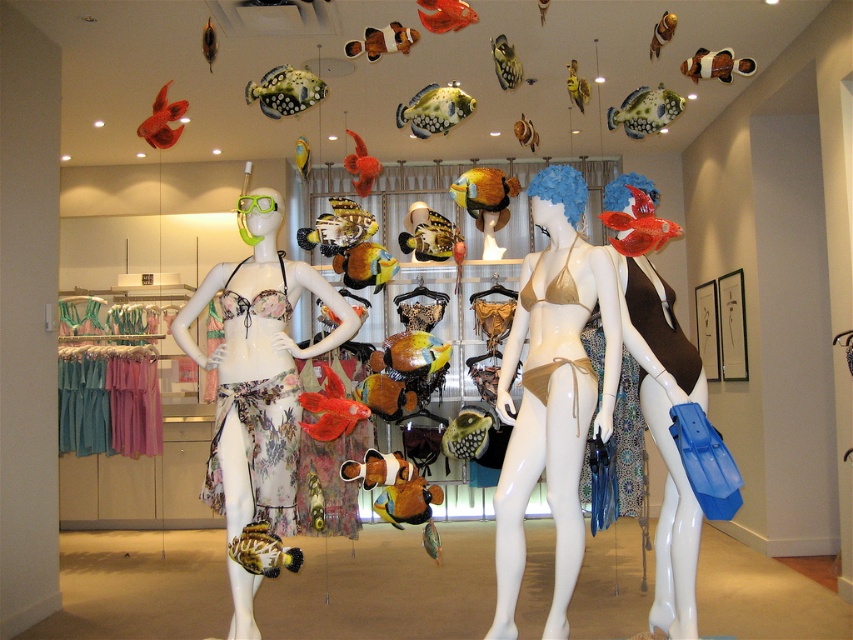
Is point (630, 205) positioned after point (405, 298)?

No.

I want to click on matte brown swimsuit at center, so click(659, 388).

Image resolution: width=853 pixels, height=640 pixels. What are the coordinates of `matte brown swimsuit at center` in the screenshot? It's located at (659, 388).

Does point (602, 266) lie behind point (422, 289)?

No, (602, 266) is in front of (422, 289).

This screenshot has height=640, width=853. Describe the element at coordinates (553, 392) in the screenshot. I see `gold bikini at center` at that location.

Does point (529, 440) come behind point (299, 232)?

No.

Locate an element on the screen. The width and height of the screenshot is (853, 640). gold bikini at center is located at coordinates (553, 392).

Measure the distance between floral fabric bikini top at left and camera.

floral fabric bikini top at left is 2.78 meters away from camera.

Is floral fabric bikini top at left wider than matte brown swimsuit at center?

Yes.

Does point (257, 474) come farther from viewer compared to point (636, 328)?

No, it is not.

Identify the location of floral fabric bikini top at left. Image resolution: width=853 pixels, height=640 pixels. (257, 397).